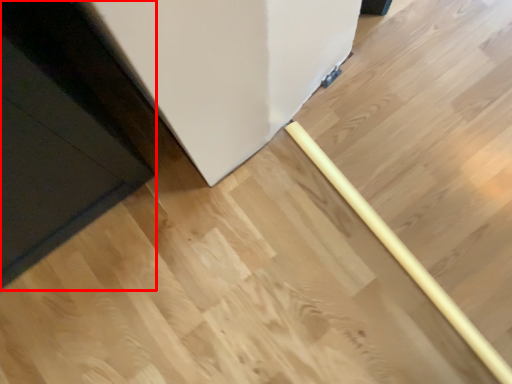
Question: From the image's perspective, what is the correct spatial positioning of door (annotated by the red box) in reference to rolling pin?

Choices:
 (A) above
 (B) below

Answer: (A)